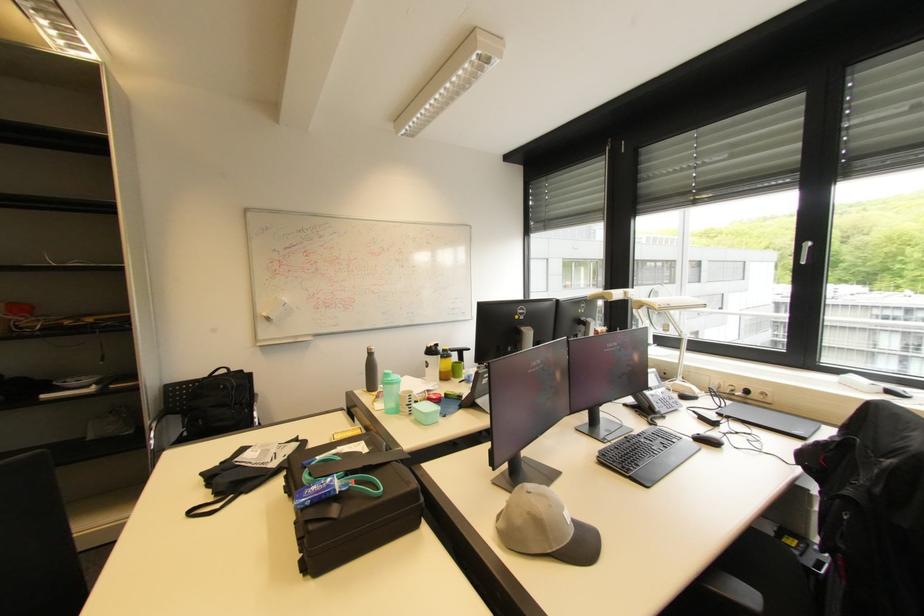
At what (x,y) coordinates should I click in order to perform the action: click on telephone receiver. Please return your answer as a coordinate pair (x, y). Image resolution: width=924 pixels, height=616 pixels. Looking at the image, I should click on (657, 400).